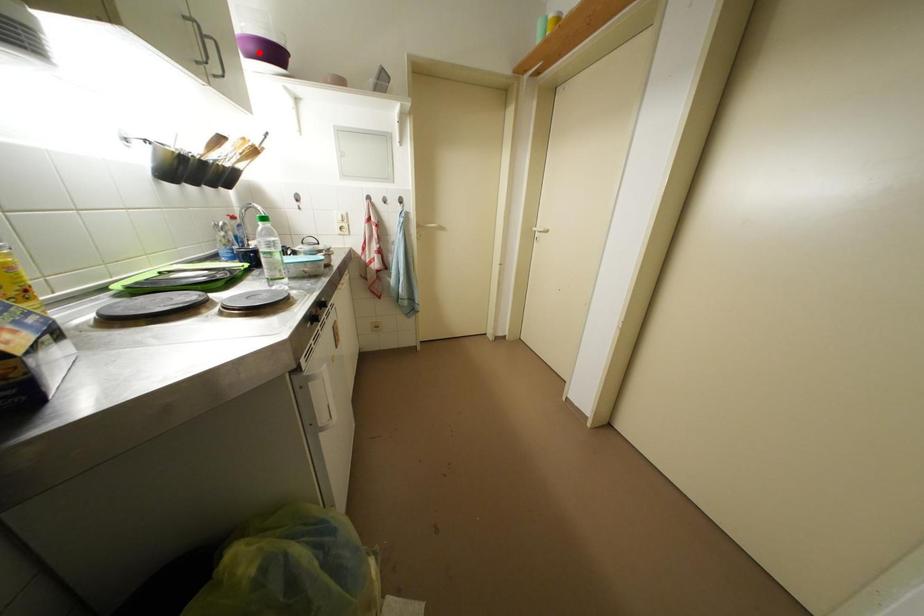
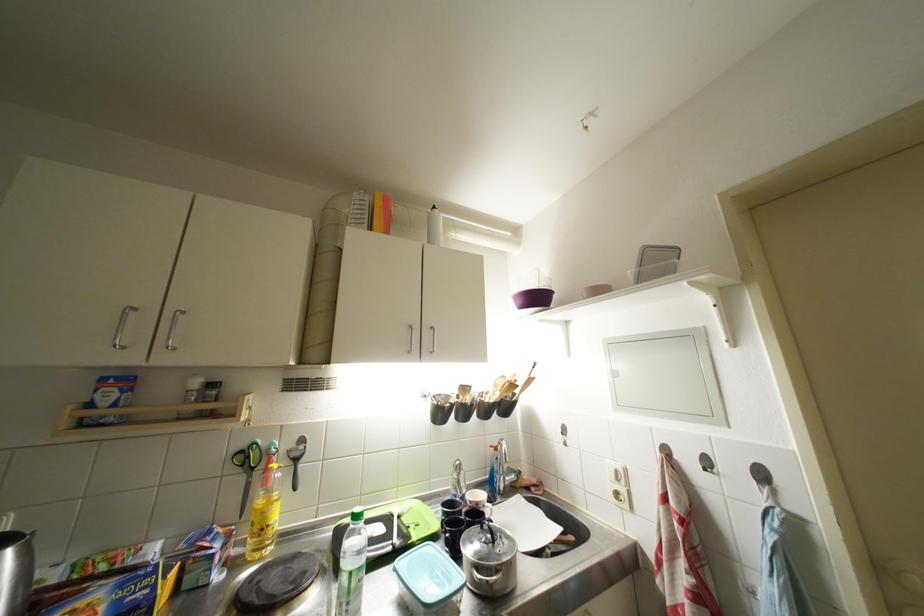
Find the pixel in the second image that matches the highlighted location in the first image.

(527, 306)